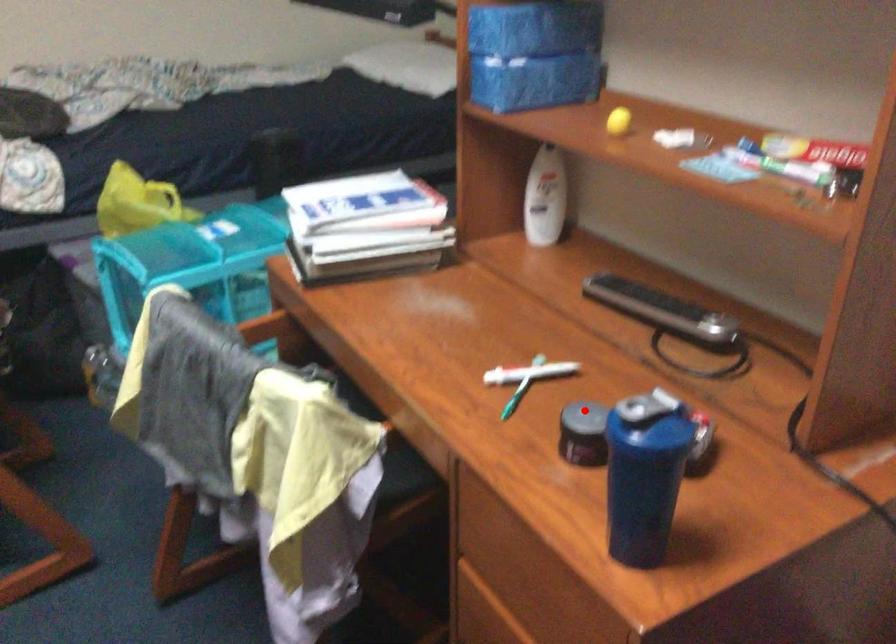
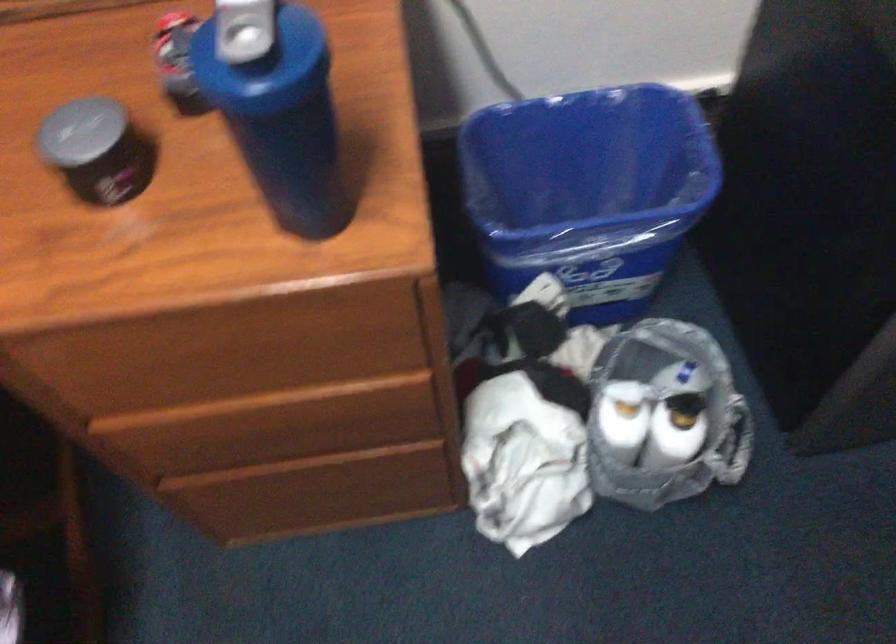
Question: A red point is marked in image1. In image2, is the corresponding 3D point closer to the camera or farther? Reply with the corresponding letter.

Choices:
 (A) The corresponding 3D point is closer.
 (B) The corresponding 3D point is farther.

Answer: (A)